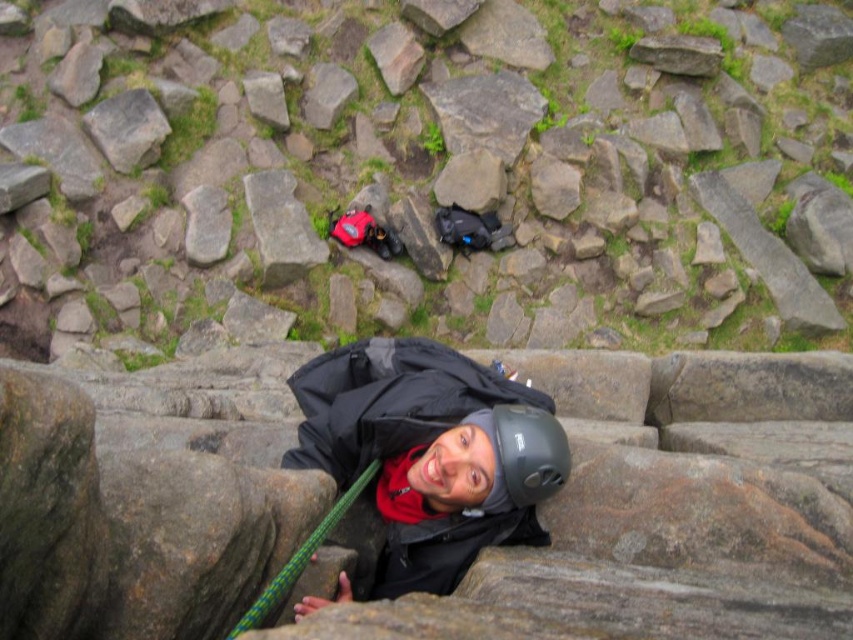
Question: Considering the relative positions of smooth gray rock at center and matte black helmet at center in the image provided, where is smooth gray rock at center located with respect to matte black helmet at center?

Choices:
 (A) below
 (B) above

Answer: (B)

Question: Can you confirm if smooth gray rock at center is positioned below gray rough rock at upper left?

Choices:
 (A) yes
 (B) no

Answer: (A)

Question: Is matte black helmet at center wider than gray rough rock at upper left?

Choices:
 (A) yes
 (B) no

Answer: (B)

Question: Which of the following is the farthest from the observer?

Choices:
 (A) smooth gray rock at center
 (B) gray rough rock at upper left

Answer: (B)

Question: Among these objects, which one is farthest from the camera?

Choices:
 (A) matte black helmet at center
 (B) gray rough rock at upper left

Answer: (B)

Question: Among these points, which one is nearest to the camera?

Choices:
 (A) (608, 280)
 (B) (161, 131)
 (C) (532, 481)

Answer: (C)